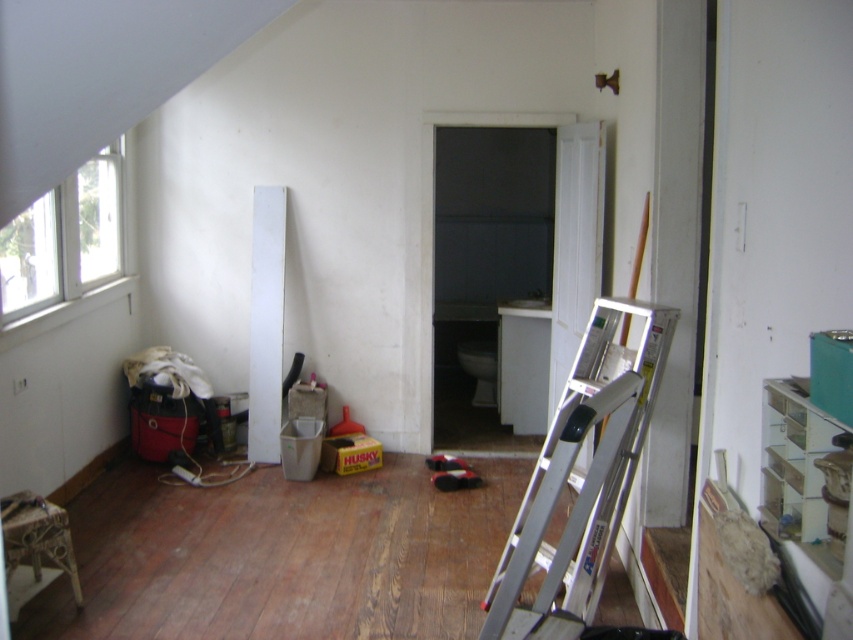
Looking at this image, you are a painter standing in the room and need to reach the white plastic window at upper left to clean it. Is the silver metallic ladder at lower right positioned in a way that would block your access to the window?

The silver metallic ladder at lower right is in front of the white plastic window at upper left, so it would block access to the window. Move the ladder to reach the window.

You are a painter who needs to reach the white plastic window at upper left. You have a silver metallic ladder at lower right that is 3.09 meters away. Can you safely move the ladder to the window?

The silver metallic ladder at lower right is 3.09 meters from the white plastic window at upper left. Since the ladder is portable, you can move it closer to the window for safe access.

You are standing in the room and want to reach the window on the left side to check if it opens. The silver metallic ladder at lower right is in your way. Can you walk around it without moving the ladder?

The silver metallic ladder at lower right is 9.30 feet away from you, so yes, you can walk around it without moving the ladder since there is enough space between you and the ladder.